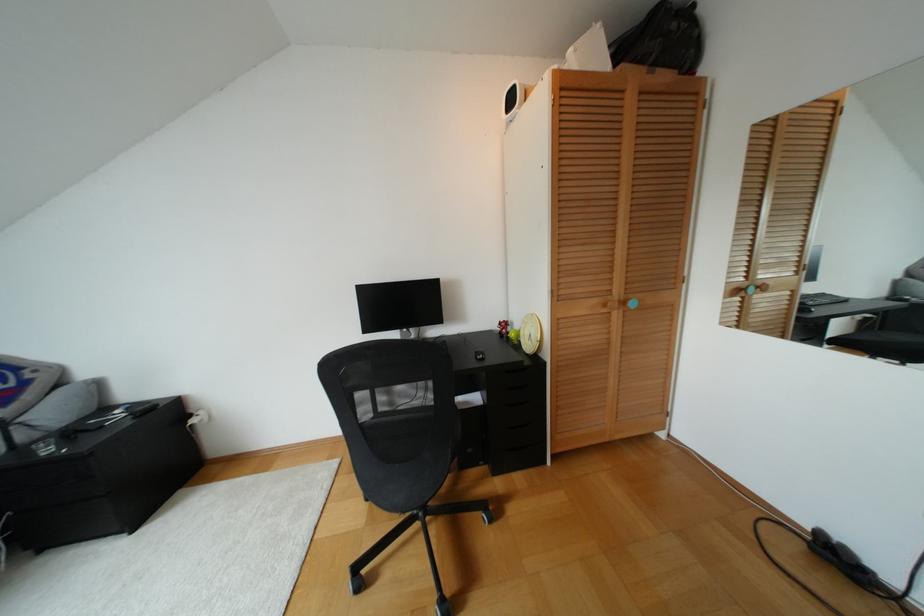
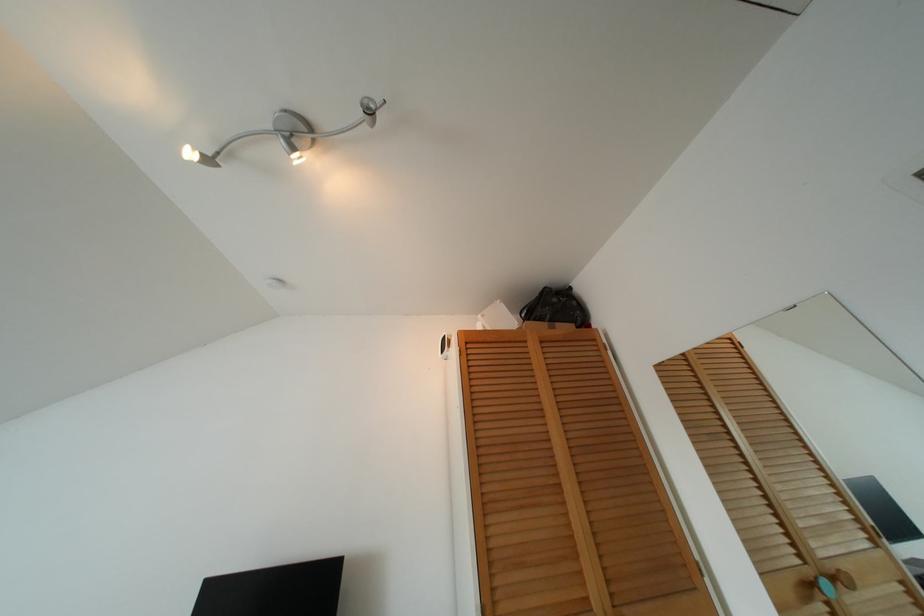
Locate, in the second image, the point that corresponds to pixel 569 50 in the first image.

(479, 315)